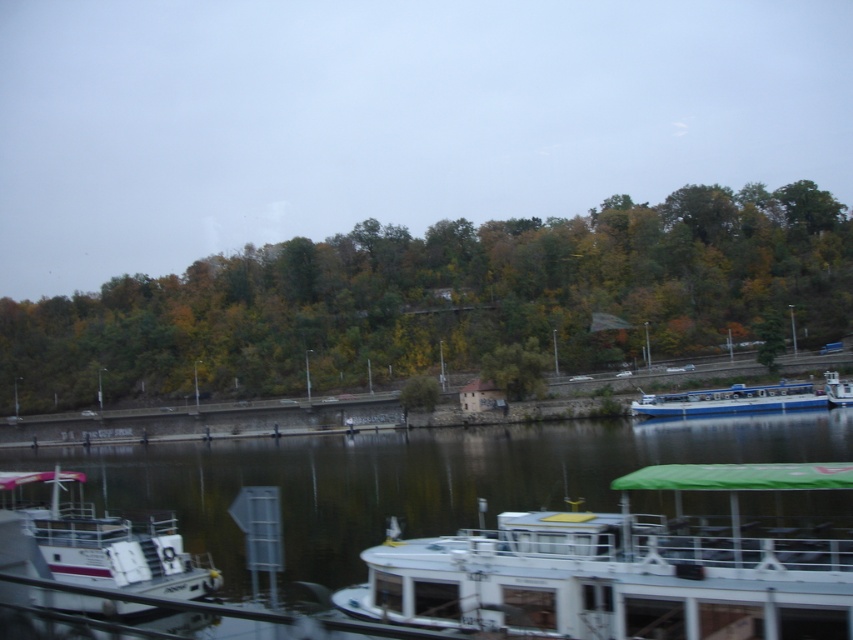
Question: Is white plastic boat at lower left in front of white plastic boat at right?

Choices:
 (A) yes
 (B) no

Answer: (A)

Question: Which point is farther to the camera?

Choices:
 (A) (692, 484)
 (B) (780, 396)
 (C) (16, 488)

Answer: (B)

Question: Does green leafy trees at center lie behind white plastic boat at lower left?

Choices:
 (A) no
 (B) yes

Answer: (B)

Question: Among these objects, which one is farthest from the camera?

Choices:
 (A) green leafy trees at center
 (B) white plastic boat at right
 (C) blue polished wood boat at right
 (D) dark green water at center

Answer: (A)

Question: Which object appears closest to the camera in this image?

Choices:
 (A) white glossy boat at lower center
 (B) dark green water at center

Answer: (B)

Question: Is blue polished wood boat at right below white plastic boat at right?

Choices:
 (A) yes
 (B) no

Answer: (A)